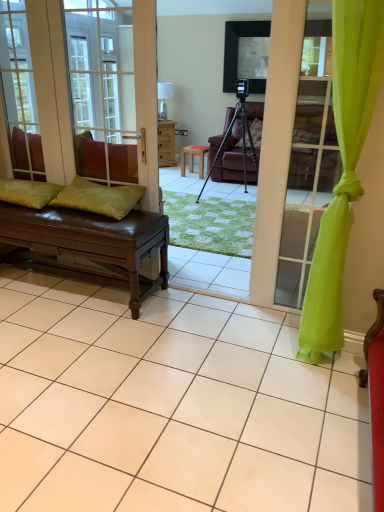
Question: Is brown leather bench at left wider than green leather pillow at left, placed as the 2th pillow when sorted from left to right?

Choices:
 (A) yes
 (B) no

Answer: (B)

Question: Does brown leather bench at left have a smaller size compared to green leather pillow at left, which is counted as the 1th pillow, starting from the right?

Choices:
 (A) no
 (B) yes

Answer: (A)

Question: Is brown leather bench at left further to the viewer compared to green leather pillow at left, which is counted as the 1th pillow, starting from the right?

Choices:
 (A) no
 (B) yes

Answer: (A)

Question: Considering the relative sizes of brown leather bench at left and green leather pillow at left, placed as the 2th pillow when sorted from left to right, in the image provided, is brown leather bench at left taller than green leather pillow at left, placed as the 2th pillow when sorted from left to right,?

Choices:
 (A) yes
 (B) no

Answer: (A)

Question: Can you see brown leather bench at left touching green leather pillow at left, placed as the 2th pillow when sorted from left to right?

Choices:
 (A) yes
 (B) no

Answer: (B)

Question: From the image's perspective, relative to brown leather bench at left, is matte black tripod at center above or below?

Choices:
 (A) above
 (B) below

Answer: (A)

Question: In terms of width, does matte black tripod at center look wider or thinner when compared to brown leather bench at left?

Choices:
 (A) thin
 (B) wide

Answer: (B)

Question: From their relative heights in the image, would you say matte black tripod at center is taller or shorter than brown leather bench at left?

Choices:
 (A) short
 (B) tall

Answer: (B)

Question: From a real-world perspective, is matte black tripod at center positioned above or below brown leather bench at left?

Choices:
 (A) below
 (B) above

Answer: (B)

Question: Is point pos(127,151) closer or farther from the camera than point pos(230,126)?

Choices:
 (A) closer
 (B) farther

Answer: (A)

Question: In terms of height, does brown leather bench at left look taller or shorter compared to matte black tripod at center?

Choices:
 (A) short
 (B) tall

Answer: (B)

Question: From the image's perspective, is brown leather bench at left above or below matte black tripod at center?

Choices:
 (A) above
 (B) below

Answer: (B)

Question: Considering the positions of brown leather bench at left and matte black tripod at center in the image, is brown leather bench at left wider or thinner than matte black tripod at center?

Choices:
 (A) wide
 (B) thin

Answer: (B)

Question: Is wooden stool at center wider or thinner than brown leather bench at left?

Choices:
 (A) thin
 (B) wide

Answer: (A)

Question: Is wooden stool at center taller or shorter than brown leather bench at left?

Choices:
 (A) tall
 (B) short

Answer: (B)